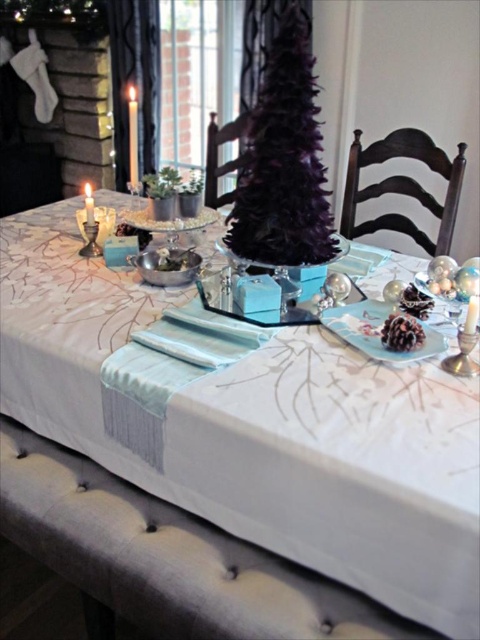
You are a guest at the festive table and want to light both the matte white candle at upper left and the matte silver candle at center. If you have a candle snuffer that can only accommodate candles up to 5 cm in width, which candle should you avoid using the snuffer on?

The matte white candle at upper left has a larger width than the matte silver candle at center, so you should avoid using the snuffer on the matte white candle at upper left since it exceeds the snuffer size limit.

You are a guest at this festive table. You want to light the candles but only have a lighter that can handle candles up to 4 inches tall. Which candle, the matte white candle at upper left or the matte silver candle at center, is safe to light with your lighter?

The matte silver candle at center is shorter than the matte white candle at upper left, so the matte silver candle at center is safe to light with your lighter since it is under 4 inches tall.